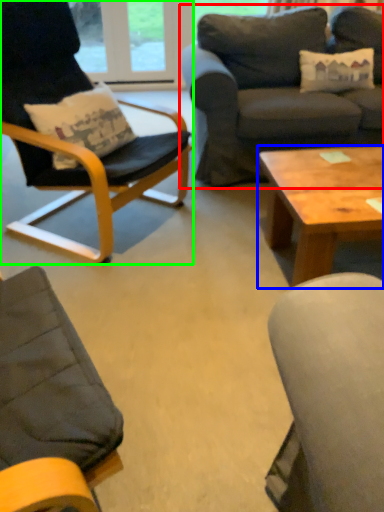
Question: Considering the real-world distances, which object is closest to studio couch (highlighted by a red box)? coffee table (highlighted by a blue box) or chair (highlighted by a green box).

Choices:
 (A) coffee table
 (B) chair

Answer: (B)